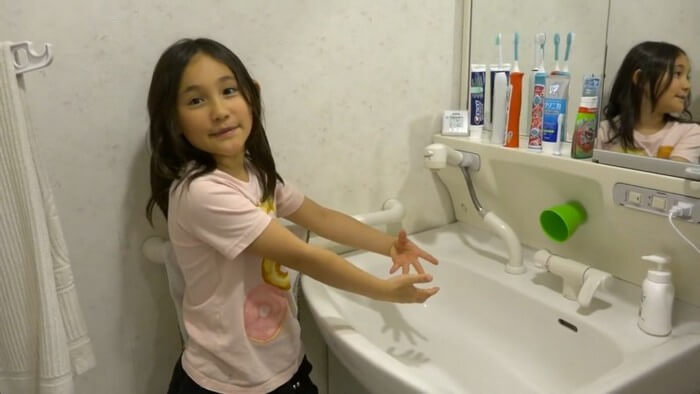
You are a GUI agent. You are given a task and a screenshot of the screen. Output one action in this format:
    pyautogui.click(x=<x>, y=<y>)
    Task: Click on the cord
    
    Given the screenshot: What is the action you would take?
    pyautogui.click(x=680, y=217)